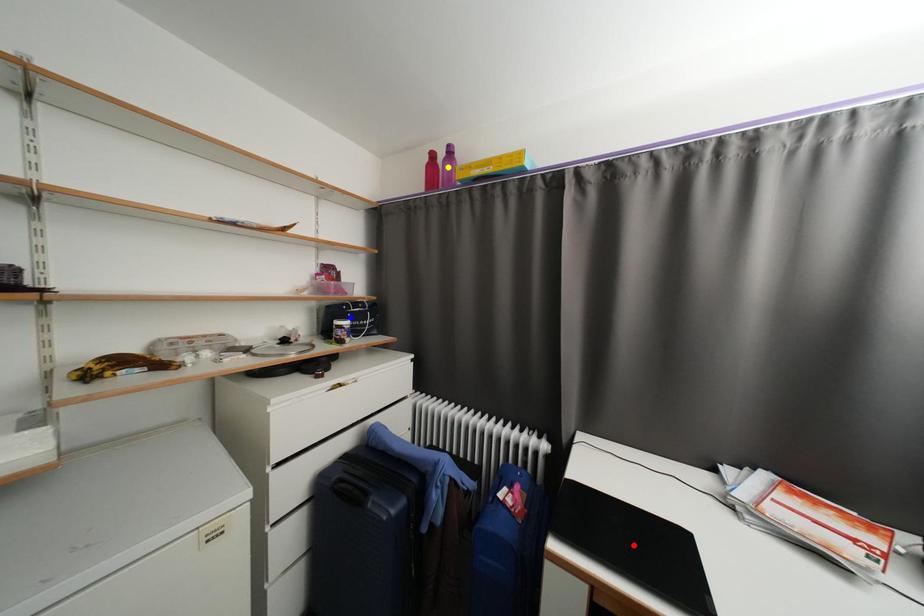
Order these from nearest to farthest:
yellow point | blue point | red point

red point
yellow point
blue point